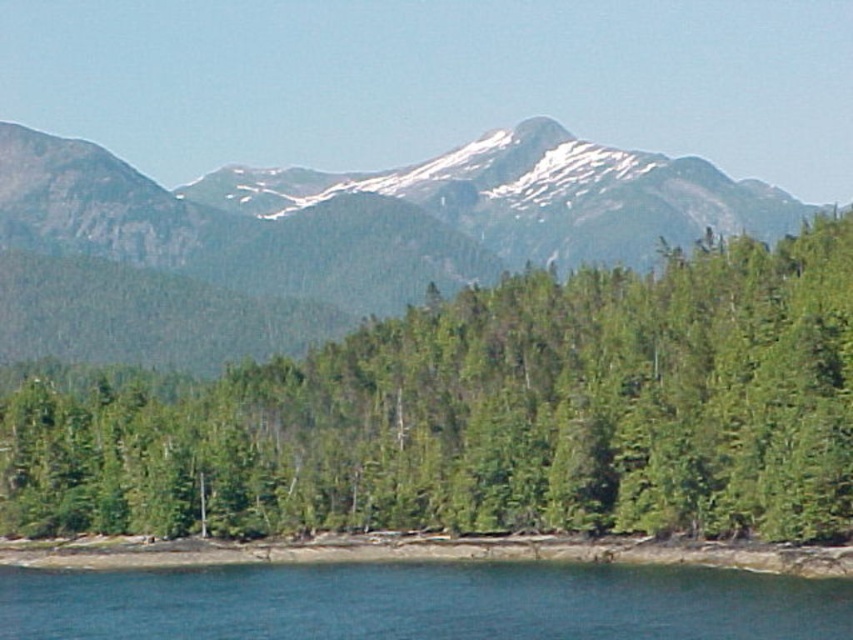
You are standing in the forest and want to take a photo of the green matte tree at center. If your camera has a maximum focus range of 130 meters, will it be able to capture the tree clearly?

The green matte tree at center is 135.16 meters away from the camera, which exceeds the maximum focus range of 130 meters. Therefore, the camera will not be able to capture the tree clearly.

You are an environmental scientist assessing the landscape. You observe the green matte tree at center and the green forested mountain at upper center. Which object has a narrower width when viewed from above?

The green matte tree at center is thinner than the green forested mountain at upper center, so the green matte tree at center has a narrower width when viewed from above.